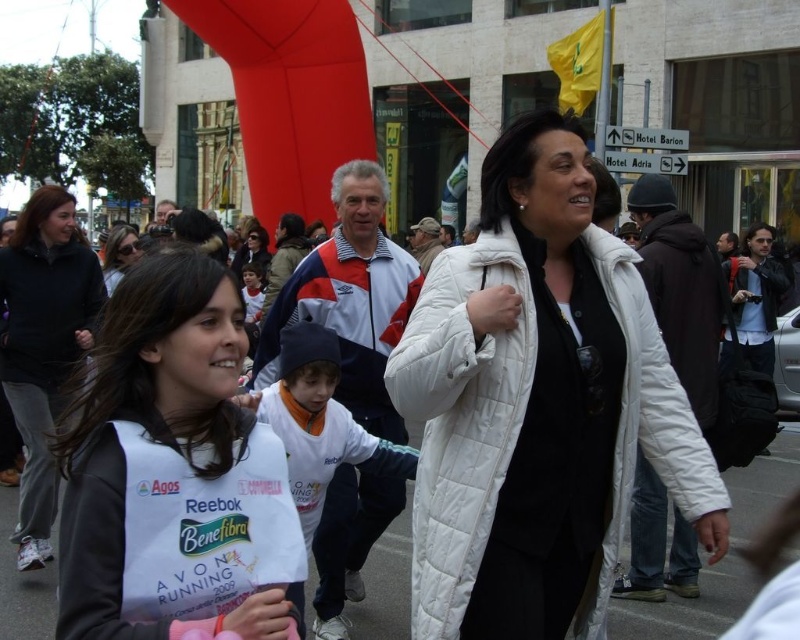
Question: Does black fleece jacket at lower left have a greater width compared to white fleece jacket at center?

Choices:
 (A) no
 (B) yes

Answer: (A)

Question: Which point is farther to the camera?

Choices:
 (A) (81, 252)
 (B) (256, 285)
 (C) (124, 349)
 (D) (304, 353)

Answer: (B)

Question: Which point is closer to the camera?

Choices:
 (A) matte white jacket at center
 (B) white fleece jacket at center
 (C) black fleece vest at center

Answer: (C)

Question: Among these points, which one is farthest from the camera?

Choices:
 (A) (73, 634)
 (B) (390, 460)

Answer: (B)

Question: Is white quilted jacket at center to the right of white cotton shirt at center from the viewer's perspective?

Choices:
 (A) no
 (B) yes

Answer: (B)

Question: Is white fleece jacket at center above matte white jacket at center?

Choices:
 (A) no
 (B) yes

Answer: (A)